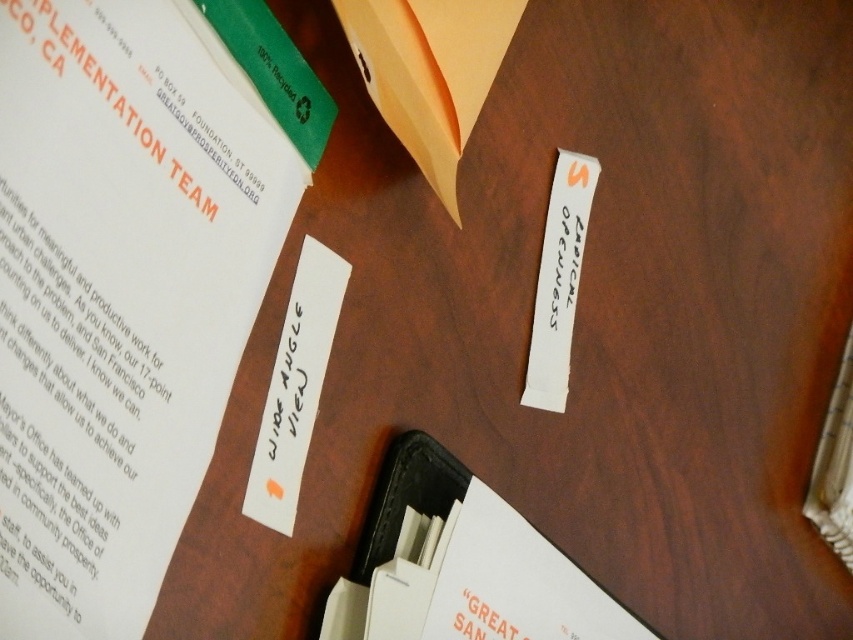
Which of these two, white paper at upper left or black leather binder at lower right, stands shorter?

With less height is black leather binder at lower right.

Between white paper at upper left and black leather binder at lower right, which one appears on the right side from the viewer's perspective?

From the viewer's perspective, black leather binder at lower right appears more on the right side.

The height and width of the screenshot is (640, 853). Describe the element at coordinates (119, 294) in the screenshot. I see `white paper at upper left` at that location.

This screenshot has width=853, height=640. What are the coordinates of `white paper at upper left` in the screenshot? It's located at (119, 294).

Who is more forward, (577, 605) or (287, 376)?

Positioned in front is point (287, 376).

What do you see at coordinates (461, 564) in the screenshot? I see `black leather binder at lower right` at bounding box center [461, 564].

Between point (520, 544) and point (314, 336), which one is positioned in front?

Point (314, 336) is more forward.

Locate an element on the screen. black leather binder at lower right is located at coordinates (461, 564).

Is white matte paper at center smaller than white paper at upper right?

Actually, white matte paper at center might be larger than white paper at upper right.

Who is more distant from viewer, (x=271, y=412) or (x=581, y=196)?

The point (x=581, y=196) is behind.

You are a GUI agent. You are given a task and a screenshot of the screen. Output one action in this format:
    pyautogui.click(x=<x>, y=<y>)
    Task: Click on the white matte paper at center
    
    Given the screenshot: What is the action you would take?
    pyautogui.click(x=294, y=387)